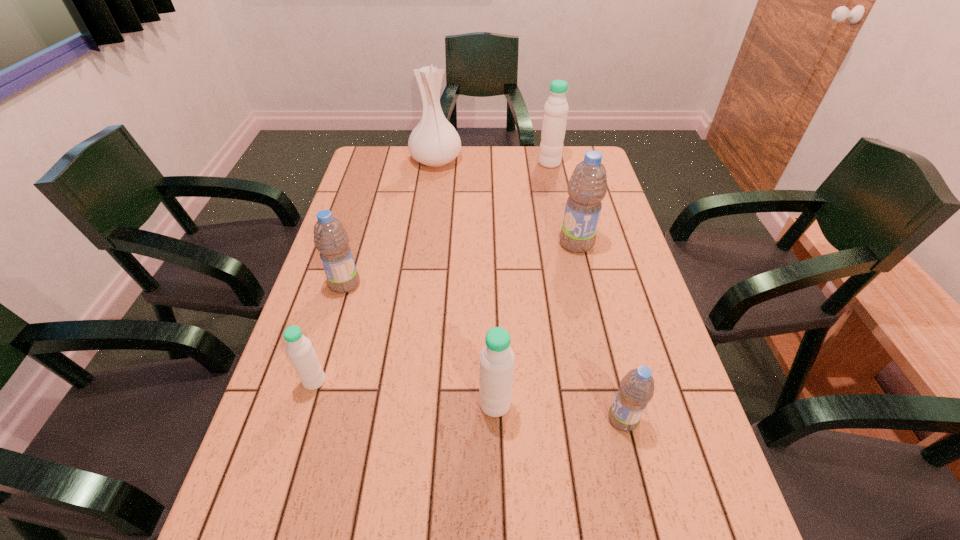
Find the location of a particular element. This screenshot has width=960, height=540. the smallest white water bottle is located at coordinates (299, 348).

This screenshot has height=540, width=960. What are the coordinates of `the smallest blue water bottle` in the screenshot? It's located at (636, 389).

This screenshot has height=540, width=960. I want to click on vacant area situated 0.150m on the right of the white vase, so click(501, 160).

Find the location of a particular element. vacant space located 0.090m on the front of the farthest white water bottle is located at coordinates (554, 183).

The height and width of the screenshot is (540, 960). In order to click on free space located on the front of the farthest blue water bottle in this screenshot , I will do `click(588, 291)`.

Where is `free space located on the back of the fourth nearest object`? free space located on the back of the fourth nearest object is located at coordinates (357, 243).

The image size is (960, 540). I want to click on free location located 0.130m on the front of the third water bottle from left to right, so click(497, 483).

Find the location of a particular element. blank area located 0.100m on the right of the leftmost white water bottle is located at coordinates (371, 381).

This screenshot has height=540, width=960. In order to click on vacant space located 0.190m on the left of the smallest blue water bottle in this screenshot , I will do `click(517, 419)`.

Locate an element on the screen. This screenshot has width=960, height=540. vase at the far edge is located at coordinates (434, 142).